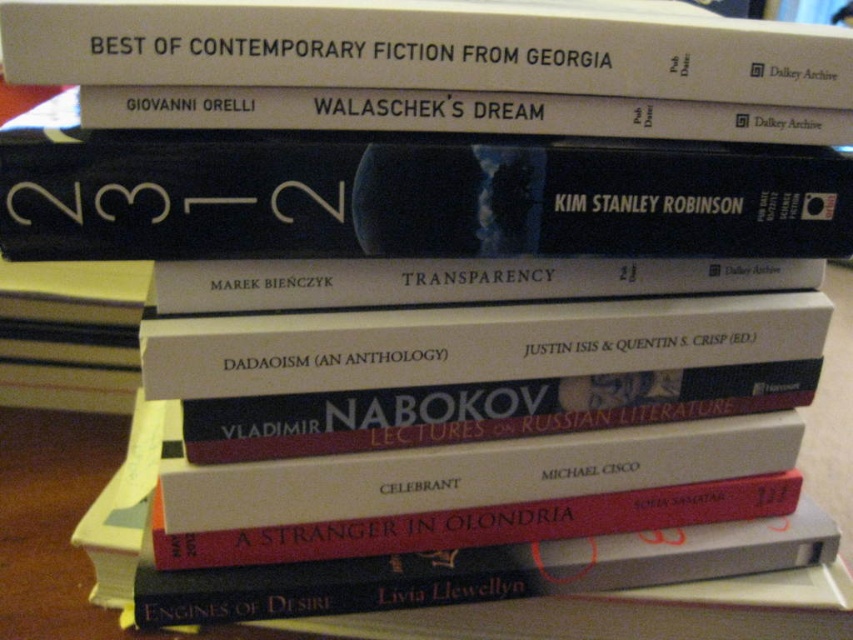
Question: Where is dark blue hardcover book at upper center located in relation to hardcover book at upper center in the image?

Choices:
 (A) below
 (B) above

Answer: (A)

Question: Is dark blue hardcover book at upper center further to camera compared to hardcover book at upper center?

Choices:
 (A) no
 (B) yes

Answer: (B)

Question: Which point is farther from the camera taking this photo?

Choices:
 (A) (175, 236)
 (B) (97, 35)

Answer: (A)

Question: Which of the following is the farthest from the observer?

Choices:
 (A) hardcover book at upper center
 (B) dark blue hardcover book at upper center

Answer: (B)

Question: Can you confirm if dark blue hardcover book at upper center is positioned to the right of hardcover book at upper center?

Choices:
 (A) yes
 (B) no

Answer: (A)